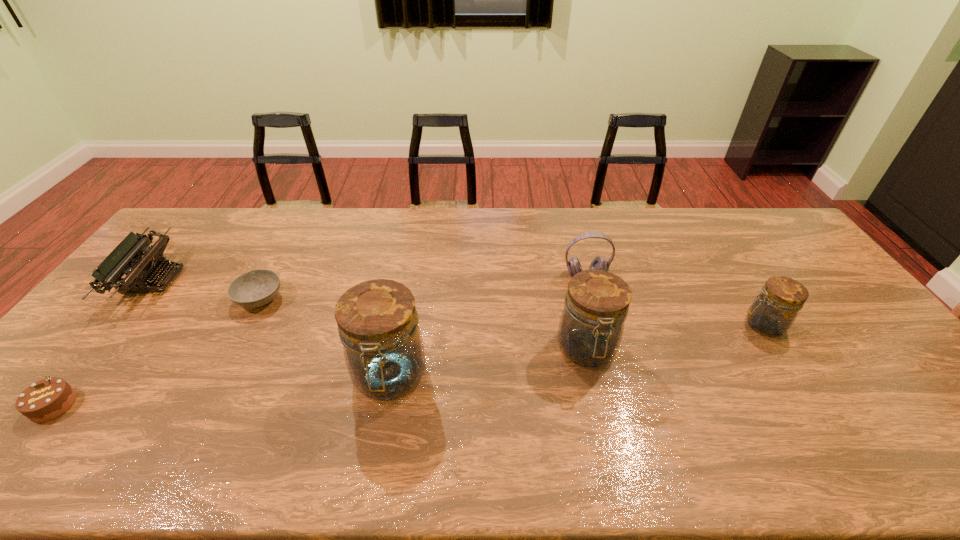
You are a GUI agent. You are given a task and a screenshot of the screen. Output one action in this format:
    pyautogui.click(x=<x>, y=<y>)
    Task: Click on the typewriter that is at the left edge
    
    Given the screenshot: What is the action you would take?
    pyautogui.click(x=126, y=258)

I want to click on chocolate cake that is at the left edge, so click(x=47, y=399).

This screenshot has width=960, height=540. Find the location of `object that is at the near left corner`. object that is at the near left corner is located at coordinates (47, 399).

I want to click on vacant space at the far edge of the desktop, so click(357, 214).

Identify the location of free region at the near edge of the desktop. (435, 424).

Where is `vacant space at the right edge of the desktop`? The image size is (960, 540). vacant space at the right edge of the desktop is located at coordinates point(809,275).

Find the location of a particular element. vacant space at the far left corner of the desktop is located at coordinates (176, 242).

Image resolution: width=960 pixels, height=540 pixels. What are the coordinates of `free spot at the far right corner of the desktop` in the screenshot? It's located at (790, 237).

You are a GUI agent. You are given a task and a screenshot of the screen. Output one action in this format:
    pyautogui.click(x=<x>, y=<y>)
    Task: Click on the vacant region between the chocolate cake and the second shortest jar
    
    Given the screenshot: What is the action you would take?
    pyautogui.click(x=320, y=377)

This screenshot has height=540, width=960. I want to click on vacant region between the leftmost jar and the headset, so click(x=488, y=326).